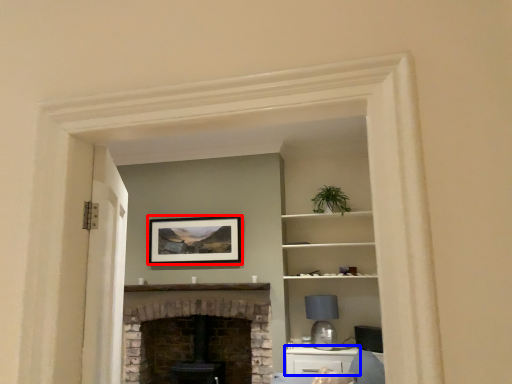
Question: Which point is further to the camera, picture frame (highlighted by a red box) or cabinetry (highlighted by a blue box)?

Choices:
 (A) picture frame
 (B) cabinetry

Answer: (A)